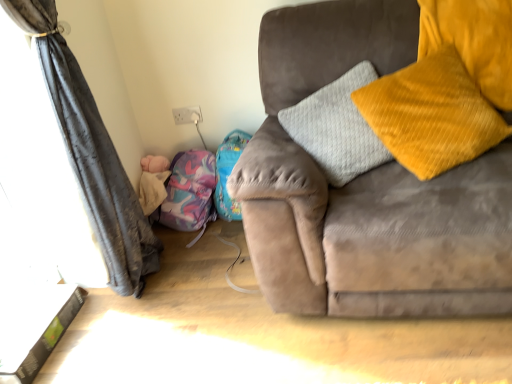
Where is `spots to the right of dark grey fabric curtain at left`? spots to the right of dark grey fabric curtain at left is located at coordinates (211, 302).